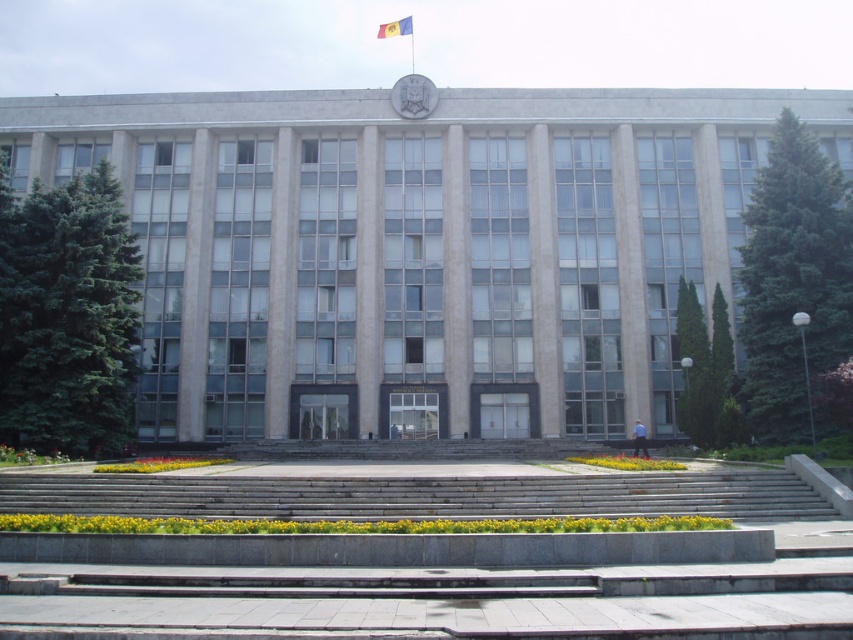
You are an architect visiting the building and want to place a new decorative element between the matte gray emblem at center and the blue fabric flag at upper center. Based on their positions, where should you position the new element?

The matte gray emblem at center is located below the blue fabric flag at upper center, so you should position the new element between them vertically, placing it above the matte gray emblem at center and below the blue fabric flag at upper center.

You are standing in front of the building and want to enter through the entrance. Which object from the scene is directly above the entrance? Please choose between the gray concrete stairs at center and the blue fabric flag at upper center.

The blue fabric flag at upper center is directly above the entrance because it is located above the gray concrete stairs at center, which lead up to the entrance.

You are standing at the base of the gray concrete stairs at center and want to look up towards the blue fabric flag at upper center. Which direction should you turn your head to see the flag?

The gray concrete stairs at center is positioned on the right side of blue fabric flag at upper center, so you should turn your head to the left to see the flag.